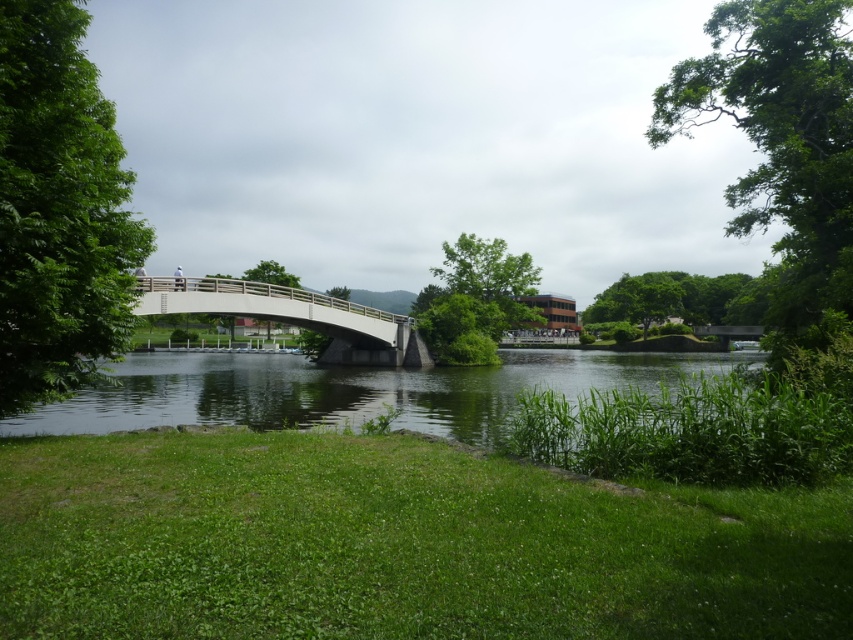
Between green grassy lake at center and white concrete bridge at center, which one is positioned lower?

green grassy lake at center is below.

Based on the photo, can you confirm if green grassy lake at center is positioned to the left of white concrete bridge at center?

No, green grassy lake at center is not to the left of white concrete bridge at center.

Who is more forward, (688,355) or (288,317)?

Point (288,317)

The width and height of the screenshot is (853, 640). What are the coordinates of `green grassy lake at center` in the screenshot? It's located at (349, 390).